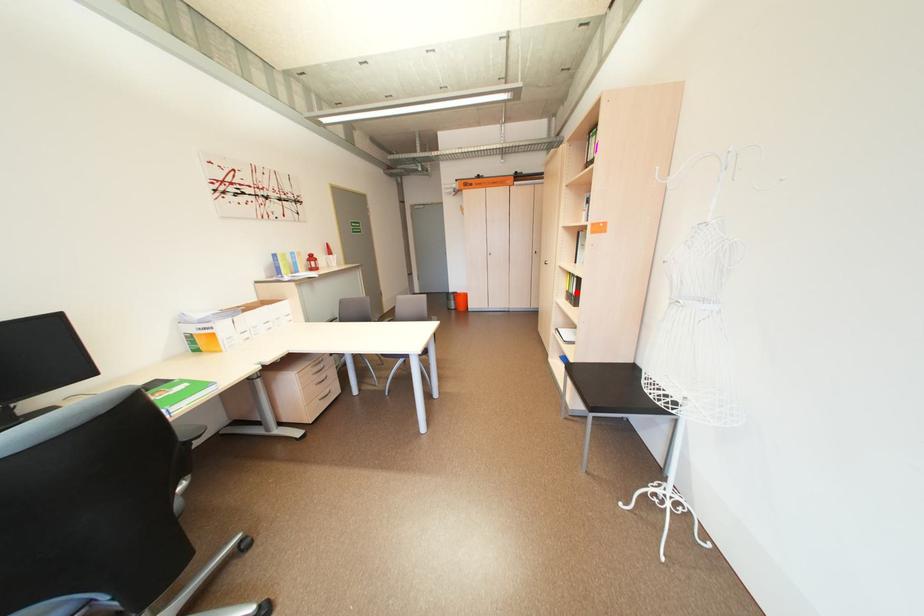
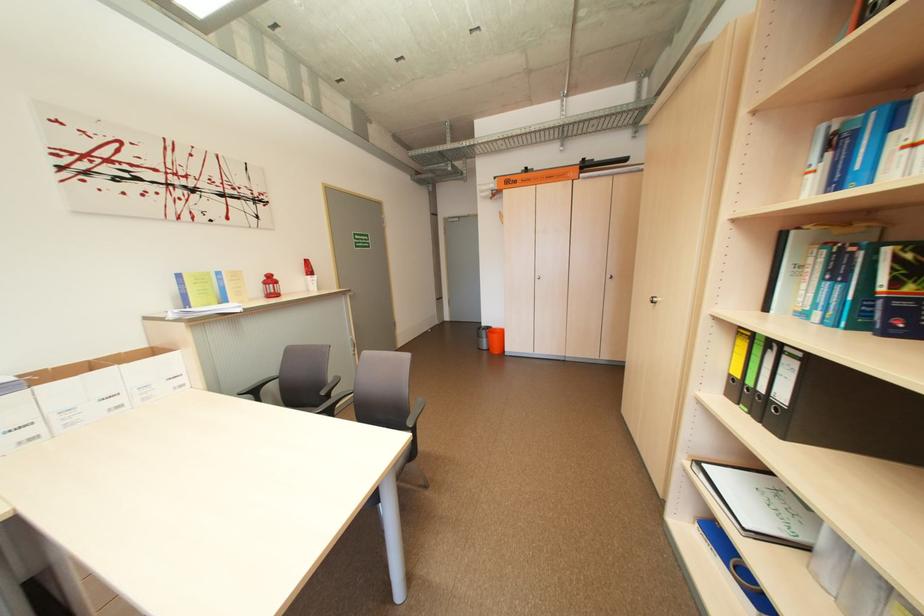
Locate, in the second image, the point that corresponds to the highlighted location in the first image.

(743, 379)